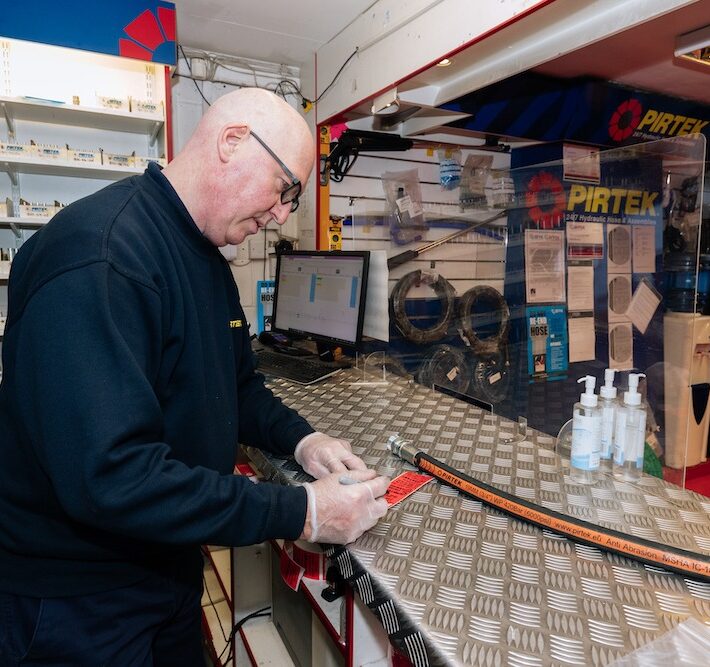
Where is `shelves`? This screenshot has width=710, height=667. shelves is located at coordinates (4, 277), (21, 221), (65, 169), (92, 115).